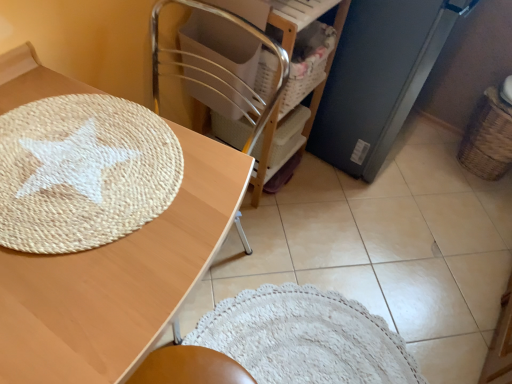
Identify the location of vacant space situated above natural wood table at upper left (from a real-world perspective). (88, 199).